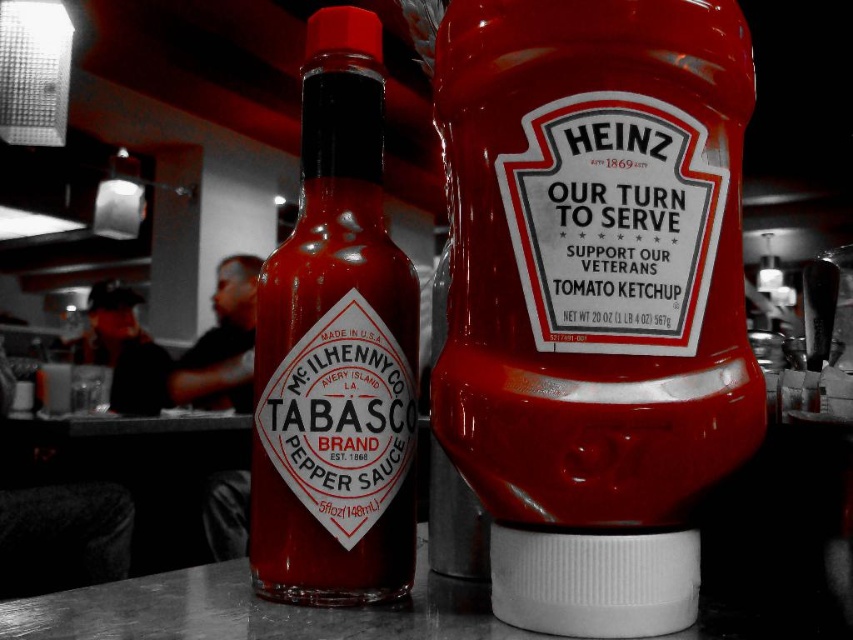
Looking at this image, does glossy plastic bottle at center appear on the right side of matte glass tabasco pepper sauce at center?

Indeed, glossy plastic bottle at center is positioned on the right side of matte glass tabasco pepper sauce at center.

Between glossy plastic bottle at center and matte glass tabasco pepper sauce at center, which one appears on the left side from the viewer's perspective?

Positioned to the left is matte glass tabasco pepper sauce at center.

Image resolution: width=853 pixels, height=640 pixels. Identify the location of glossy plastic bottle at center. (595, 257).